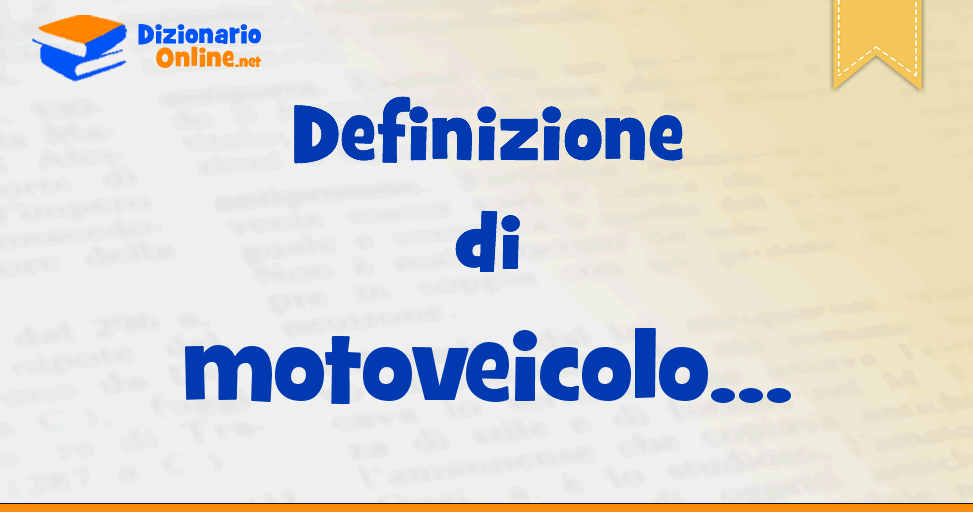
I want to click on orange book, so click(x=78, y=31).